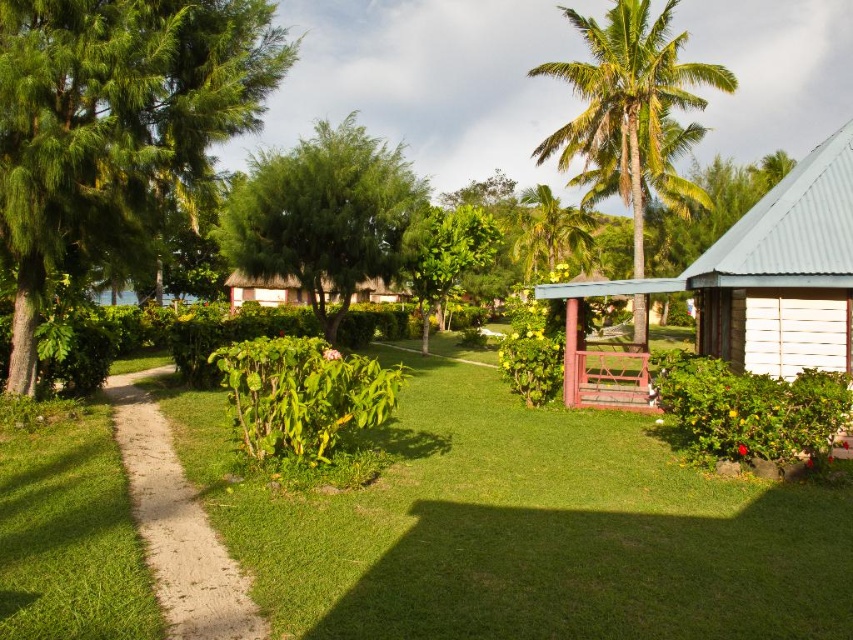
You are standing at the entrance of the resort garden and see two points marked in the scene. Which point is closer to you, point (547, 150) or point (241, 588)?

Point (547, 150) is further to the camera than point (241, 588), so the closer point to you is point (241, 588).

You are a landscape architect designing a new garden layout. You need to place a statue between the green leafy tree at center and the green leafy palm tree at upper right. Based on their heights, which tree should the statue be closer to for visual balance?

The green leafy palm tree at upper right is taller than the green leafy tree at center, so the statue should be placed closer to the shorter green leafy tree at center to achieve visual balance.